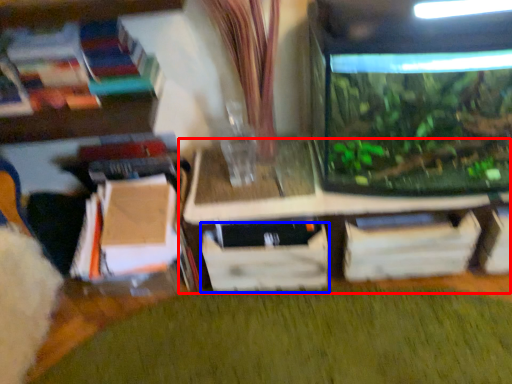
Question: Which point is closer to the camera, table (highlighted by a red box) or drawer (highlighted by a blue box)?

Choices:
 (A) table
 (B) drawer

Answer: (A)